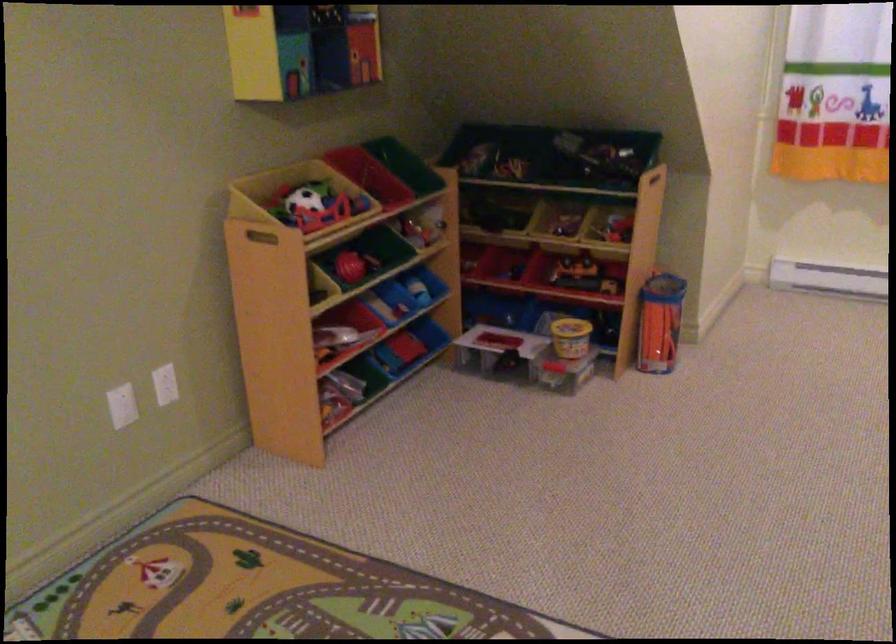
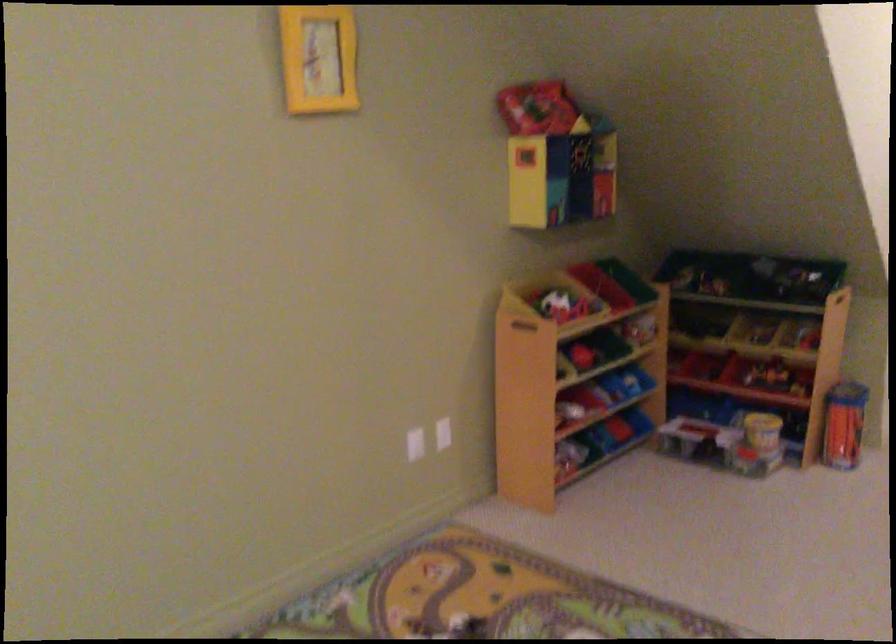
Find the pixel in the second image that matches (649,325) in the first image.

(843, 424)